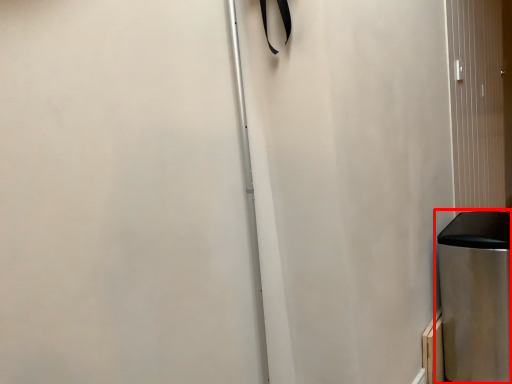
Question: From the image, what is the correct spatial relationship of waste container (annotated by the red box) in relation to screen door?

Choices:
 (A) right
 (B) left

Answer: (B)